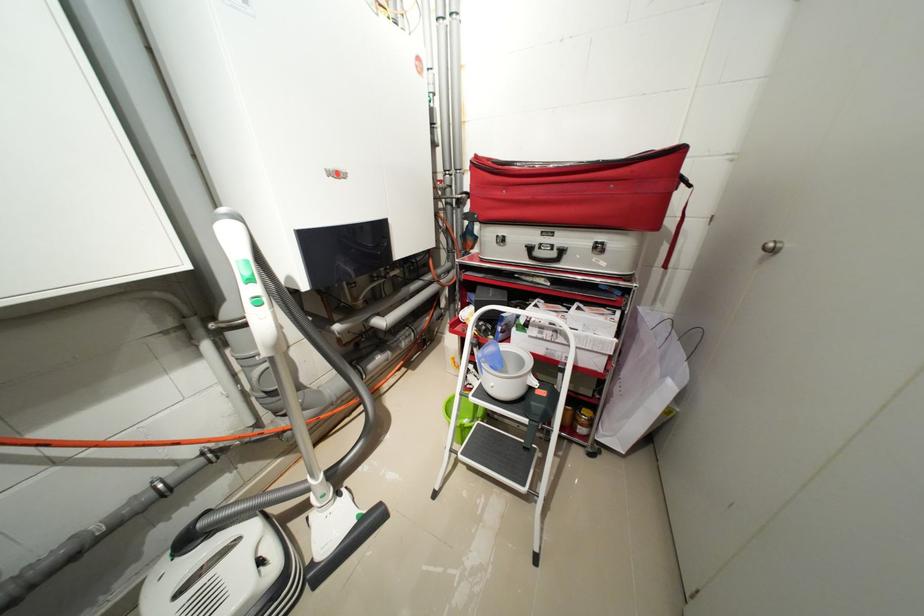
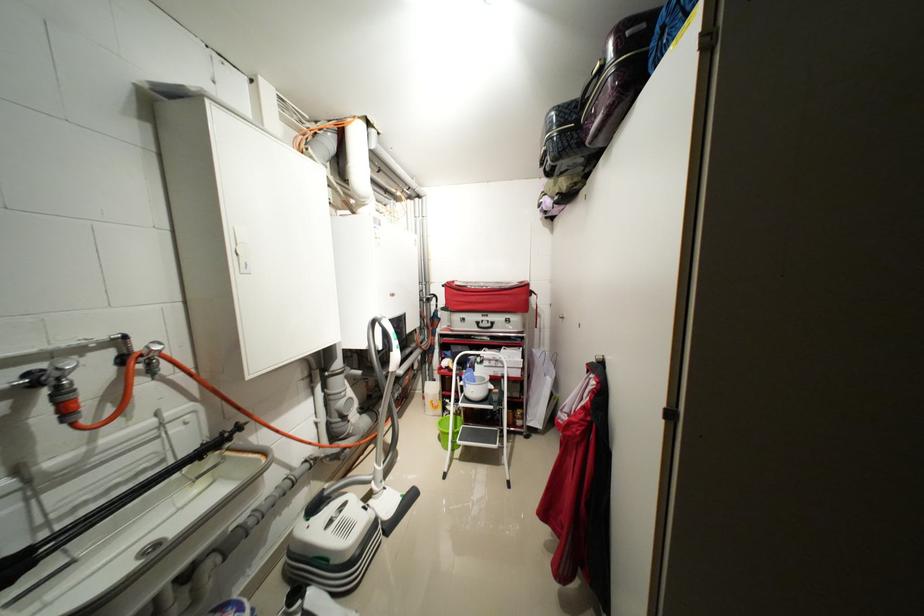
Where in the second image is the point corresponding to (483,158) from the first image?

(455, 284)